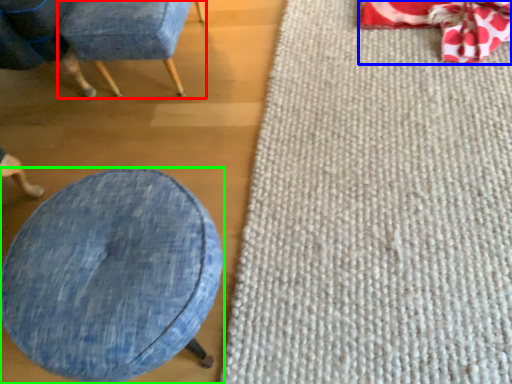
Question: Which is nearer to the chair (highlighted by a red box)? bean bag chair (highlighted by a blue box) or furniture (highlighted by a green box).

Choices:
 (A) bean bag chair
 (B) furniture

Answer: (B)